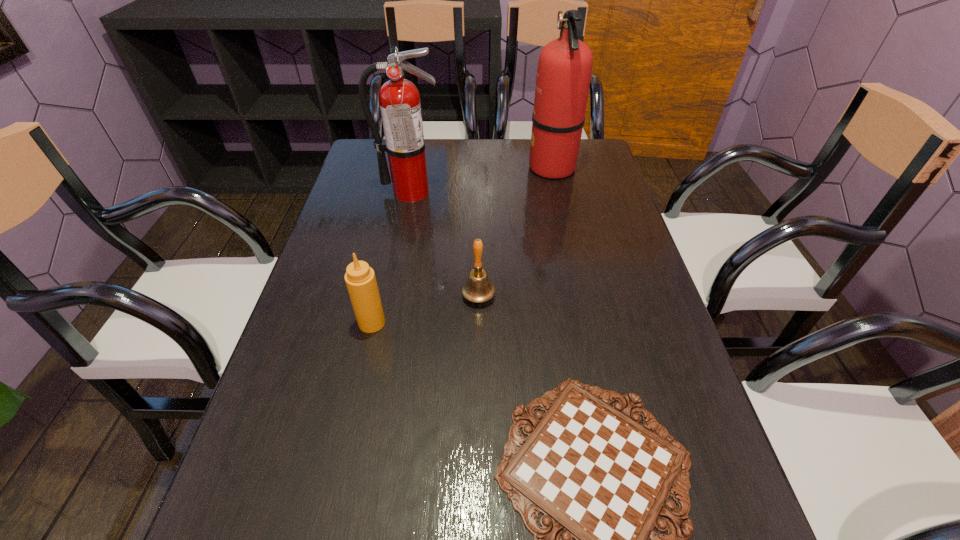
The image size is (960, 540). What are the coordinates of `the right fire extinguisher` in the screenshot? It's located at (564, 70).

You are a GUI agent. You are given a task and a screenshot of the screen. Output one action in this format:
    pyautogui.click(x=<x>, y=<y>)
    Task: Click on the left fire extinguisher
    This screenshot has height=540, width=960.
    Given the screenshot: What is the action you would take?
    coord(399,99)

This screenshot has height=540, width=960. Find the location of `the fourth farthest object`. the fourth farthest object is located at coordinates (360, 279).

Identify the location of the second shortest object. Image resolution: width=960 pixels, height=540 pixels. point(478,289).

Find the location of `the third nearest object`. the third nearest object is located at coordinates (478, 289).

Where is `vacant space located on the side of the right fire extinguisher with the nozzle and handle`? The width and height of the screenshot is (960, 540). vacant space located on the side of the right fire extinguisher with the nozzle and handle is located at coordinates (493, 167).

Find the location of a particular element. The image size is (960, 540). free space located 0.270m on the side of the right fire extinguisher with the nozzle and handle is located at coordinates (444, 167).

The width and height of the screenshot is (960, 540). Find the location of `vacant space situated on the side of the right fire extinguisher with the nozzle and handle`. vacant space situated on the side of the right fire extinguisher with the nozzle and handle is located at coordinates click(500, 167).

Find the location of a particular element. The height and width of the screenshot is (540, 960). vacant position located 0.390m on the nozzle side of the left fire extinguisher is located at coordinates (389, 302).

Locate an element on the screen. The height and width of the screenshot is (540, 960). free point located 0.120m on the left of the condiment is located at coordinates (303, 322).